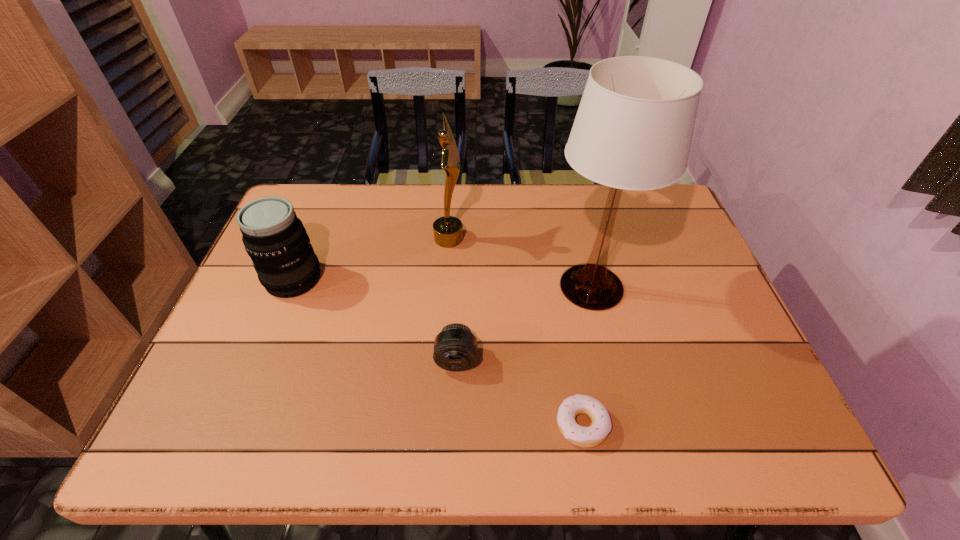
At what (x,y) coordinates should I click in order to perform the action: click on blank space at the right edge of the desktop. Please return your answer as a coordinate pair (x, y). The width and height of the screenshot is (960, 540). Looking at the image, I should click on (671, 333).

Locate an element on the screen. free region at the far left corner of the desktop is located at coordinates (303, 209).

The width and height of the screenshot is (960, 540). Find the location of `vacant space at the near right corner`. vacant space at the near right corner is located at coordinates (743, 429).

Where is `vacant area that lies between the farther telephoto lens and the tallest object`? vacant area that lies between the farther telephoto lens and the tallest object is located at coordinates (443, 283).

The image size is (960, 540). Identify the location of unoccupied area between the shorter telephoto lens and the farther telephoto lens. (375, 319).

I want to click on empty space between the taller telephoto lens and the table lamp, so click(443, 283).

I want to click on free area in between the farther telephoto lens and the award, so click(372, 259).

Locate an element on the screen. blank region between the doughnut and the farthest object is located at coordinates (516, 331).

This screenshot has width=960, height=540. I want to click on free area in between the fourth farthest object and the tallest object, so click(524, 323).

Identify the location of free spot between the farther telephoto lens and the fourth farthest object. (375, 319).